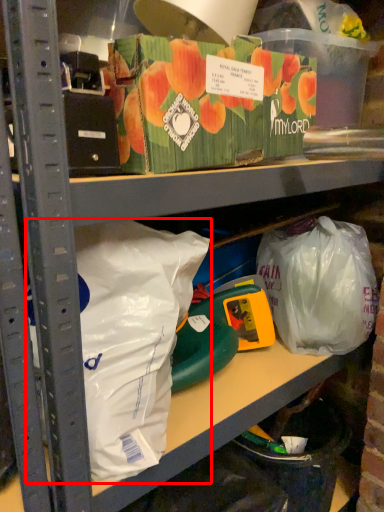
Question: Where is plastic bag (annotated by the red box) located in relation to plastic bag in the image?

Choices:
 (A) left
 (B) right

Answer: (A)